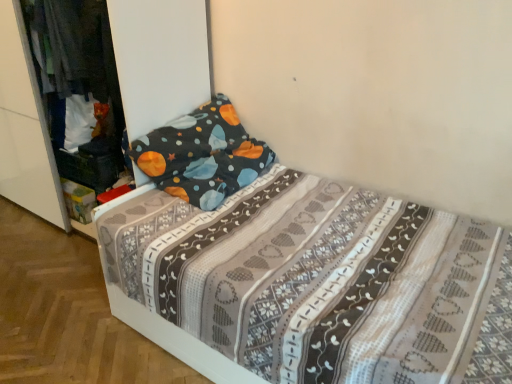
Image resolution: width=512 pixels, height=384 pixels. What do you see at coordinates (161, 58) in the screenshot?
I see `white fabric bed at center` at bounding box center [161, 58].

Find the location of a particular element. patterned fabric bed at center is located at coordinates (294, 265).

Is patterned fabric bed at center not near dark blue fabric at left?

patterned fabric bed at center is actually quite close to dark blue fabric at left.

Which is in front, point (428, 269) or point (46, 33)?

The point (428, 269) is in front.

Which is correct: patterned fabric bed at center is inside dark blue fabric at left, or outside of it?

The correct answer is: outside.

Is patterned fabric bed at center oriented towards dark blue fabric at left?

No, patterned fabric bed at center is not facing towards dark blue fabric at left.

In the scene shown: From the image's perspective, between dark blue fabric at left and white fabric bed at center, which one is located above?

dark blue fabric at left is shown above in the image.

Which of these two, dark blue fabric at left or white fabric bed at center, is thinner?

With smaller width is dark blue fabric at left.

From a real-world perspective, who is located higher, dark blue fabric at left or white fabric bed at center?

In real-world perspective, dark blue fabric at left is above.

Which is further, (39,58) or (143,179)?

Positioned behind is point (39,58).

From the image's perspective, is patterned fabric bed at center above or below white fabric bed at center?

Clearly, from the image's perspective, patterned fabric bed at center is below white fabric bed at center.

Would you say patterned fabric bed at center is to the left or to the right of white fabric bed at center in the picture?

In the image, patterned fabric bed at center appears on the right side of white fabric bed at center.

Which point is more forward, (172, 139) or (133, 122)?

The point (133, 122) is more forward.

Which of these two, patterned fabric bed at center or white fabric bed at center, is wider?

patterned fabric bed at center.

Could you tell me if white fabric bed at center is turned towards patterned fabric bed at center?

No, white fabric bed at center is not turned towards patterned fabric bed at center.

Considering the positions of objects white fabric bed at center and patterned fabric bed at center in the image provided, who is behind, white fabric bed at center or patterned fabric bed at center?

white fabric bed at center.

Which is in front, point (34, 33) or point (263, 362)?

Positioned in front is point (263, 362).

Would you say dark blue fabric at left is a long distance from patterned fabric bed at center?

They are positioned close to each other.

Would you say dark blue fabric at left contains patterned fabric bed at center?

No, patterned fabric bed at center is not a part of dark blue fabric at left.

Measure the distance from white fabric bed at center to dark blue fabric at left.

white fabric bed at center and dark blue fabric at left are 14.38 inches apart from each other.

Considering the sizes of objects white fabric bed at center and dark blue fabric at left in the image provided, who is taller, white fabric bed at center or dark blue fabric at left?

Standing taller between the two is white fabric bed at center.

Is white fabric bed at center looking in the opposite direction of dark blue fabric at left?

Yes, dark blue fabric at left is at the back of white fabric bed at center.

Where is `clothing behind the patterned fabric bed at center`? Image resolution: width=512 pixels, height=384 pixels. clothing behind the patterned fabric bed at center is located at coordinates (74, 45).

At what (x,y) coordinates should I click in order to perform the action: click on dresser directly beneath the dark blue fabric at left (from a real-world perspective). Please return your answer as a coordinate pair (x, y). The width and height of the screenshot is (512, 384). Looking at the image, I should click on (161, 58).

Based on their spatial positions, is dark blue fabric at left or white fabric bed at center closer to patterned fabric bed at center?

dark blue fabric at left.

From the picture: Considering their positions, is white fabric bed at center positioned further to dark blue fabric at left than patterned fabric bed at center?

Based on the image, patterned fabric bed at center appears to be further to dark blue fabric at left.

Considering their positions, is dark blue fabric at left positioned further to white fabric bed at center than patterned fabric bed at center?

The object further to white fabric bed at center is patterned fabric bed at center.

When comparing their distances from white fabric bed at center, does patterned fabric bed at center or dark blue fabric at left seem further?

patterned fabric bed at center is positioned further to the anchor white fabric bed at center.

Considering their positions, is patterned fabric bed at center positioned closer to dark blue fabric at left than white fabric bed at center?

white fabric bed at center lies closer to dark blue fabric at left than the other object.

Which object lies further to the anchor point patterned fabric bed at center, white fabric bed at center or dark blue fabric at left?

white fabric bed at center.

Find the location of a particular element. Image resolution: width=512 pixels, height=384 pixels. clothing located between white fabric bed at center and patterned fabric bed at center in the left-right direction is located at coordinates (74, 45).